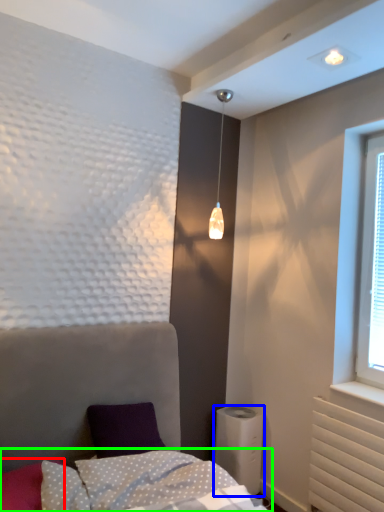
Question: Estimate the real-world distances between objects in this image. Which object is closer to pillow (highlighted by a red box), air conditioning (highlighted by a blue box) or bedding (highlighted by a green box)?

Choices:
 (A) air conditioning
 (B) bedding

Answer: (B)